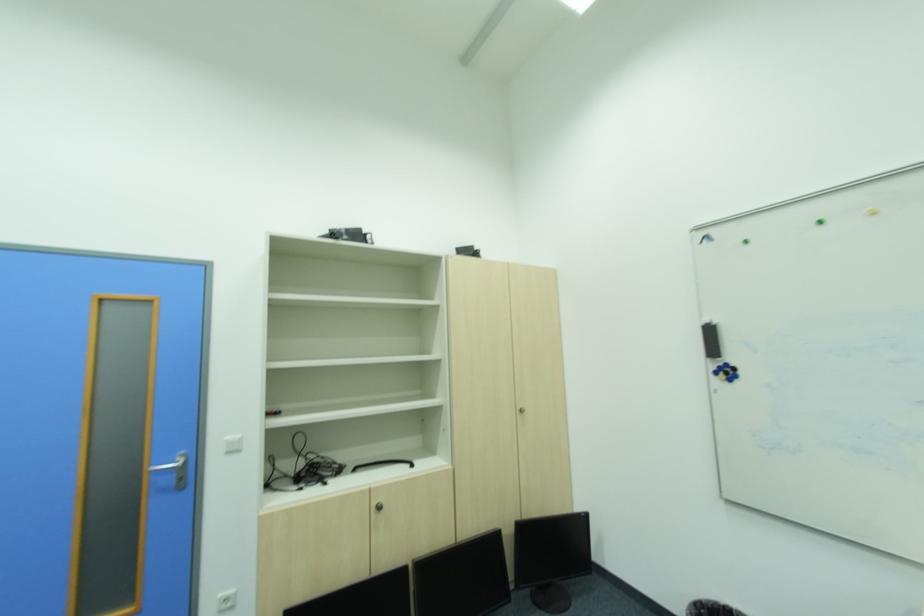
Locate an element on the screen. silver door handle is located at coordinates (x=171, y=463).